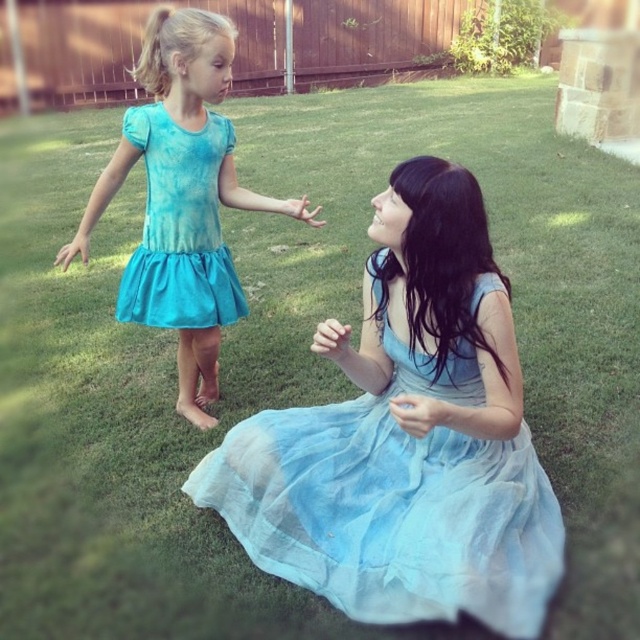
The height and width of the screenshot is (640, 640). Describe the element at coordinates (394, 499) in the screenshot. I see `light blue sheer dress at center` at that location.

Does light blue sheer dress at center have a lesser width compared to tie-dye fabric dress at left?

In fact, light blue sheer dress at center might be wider than tie-dye fabric dress at left.

This screenshot has width=640, height=640. Find the location of `light blue sheer dress at center`. light blue sheer dress at center is located at coordinates (394, 499).

Looking at this image, can you confirm if light blue sheer dress at center is bigger than turquoise fabric dress at left?

No, light blue sheer dress at center is not bigger than turquoise fabric dress at left.

Which is in front, point (268, 440) or point (168, 44)?

Positioned in front is point (268, 440).

At what (x,y) coordinates should I click in order to perform the action: click on light blue sheer dress at center. Please return your answer as a coordinate pair (x, y). The width and height of the screenshot is (640, 640). Looking at the image, I should click on (394, 499).

Between turquoise fabric dress at left and tie-dye fabric dress at left, which one has less height?

Standing shorter between the two is tie-dye fabric dress at left.

Is turquoise fabric dress at left to the left of tie-dye fabric dress at left from the viewer's perspective?

Yes, turquoise fabric dress at left is to the left of tie-dye fabric dress at left.

The height and width of the screenshot is (640, 640). In order to click on turquoise fabric dress at left in this screenshot , I will do `click(182, 198)`.